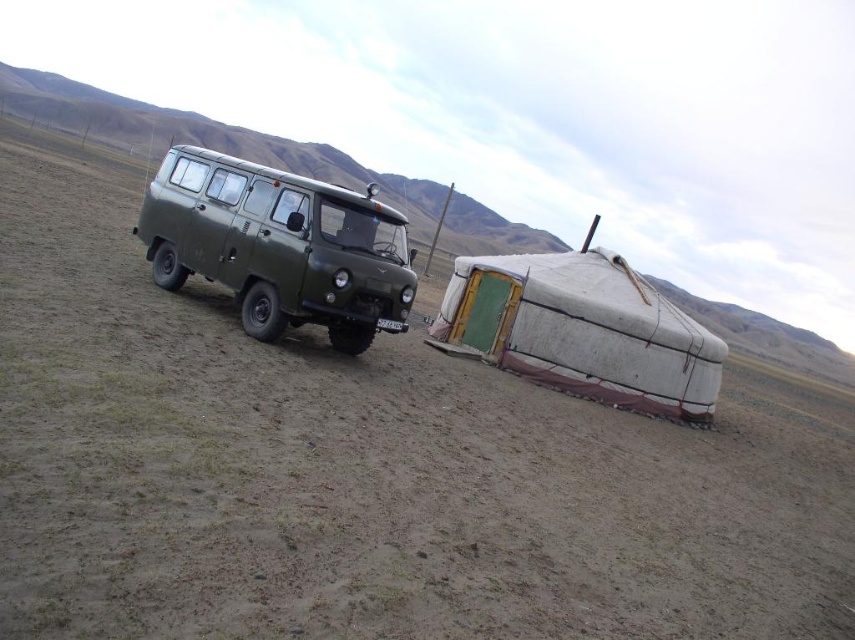
Question: Does olive green matte van at center appear on the right side of white canvas tent at lower right?

Choices:
 (A) yes
 (B) no

Answer: (B)

Question: Among these objects, which one is nearest to the camera?

Choices:
 (A) olive green matte van at center
 (B) white canvas tent at lower right

Answer: (A)

Question: Which of the following is the closest to the observer?

Choices:
 (A) olive green matte van at center
 (B) white canvas tent at lower right

Answer: (A)

Question: Is olive green matte van at center smaller than white canvas tent at lower right?

Choices:
 (A) yes
 (B) no

Answer: (B)

Question: Which point is closer to the camera?

Choices:
 (A) white canvas tent at lower right
 (B) olive green matte van at center

Answer: (B)

Question: Is olive green matte van at center positioned before white canvas tent at lower right?

Choices:
 (A) yes
 (B) no

Answer: (A)